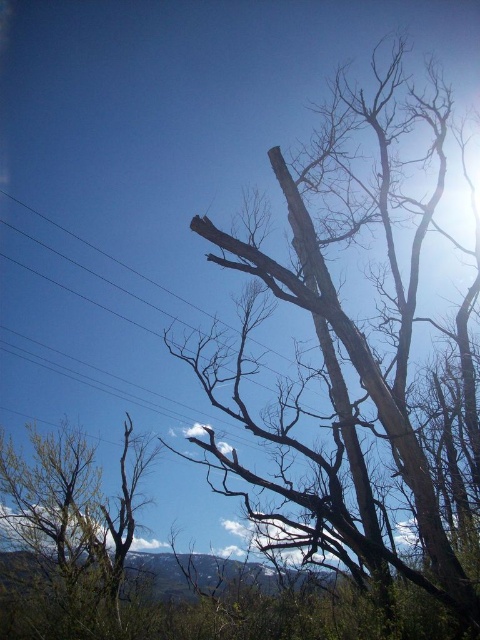
Question: Among these points, which one is nearest to the camera?

Choices:
 (A) (17, 474)
 (B) (323, 257)

Answer: (B)

Question: Does brown rough bark tree at center have a greater width compared to green leafy tree at lower left?

Choices:
 (A) no
 (B) yes

Answer: (B)

Question: Does brown rough bark tree at center have a greater width compared to green leafy tree at lower left?

Choices:
 (A) yes
 (B) no

Answer: (A)

Question: Does brown rough bark tree at center appear on the right side of green leafy tree at lower left?

Choices:
 (A) no
 (B) yes

Answer: (B)